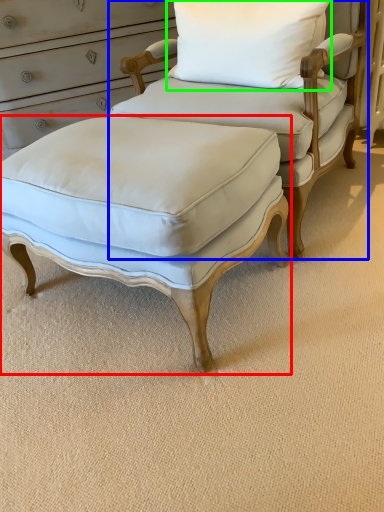
Question: Which object is the closest to the stool (highlighted by a red box)? Choose among these: chair (highlighted by a blue box) or pillow (highlighted by a green box).

Choices:
 (A) chair
 (B) pillow

Answer: (A)